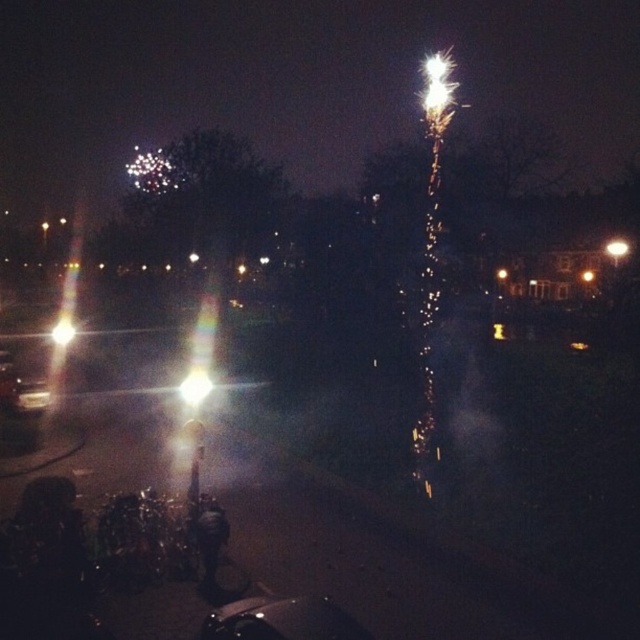
You are a photographer trying to capture the fireworks. You notice two light sources in your viewfinder, the bright white light at center and the bright metallic streetlight at left. Which one appears shorter in your photo?

The bright white light at center appears shorter because it is not as tall as the bright metallic streetlight at left.

You are a photographer trying to capture the fireworks display. You notice two light sources in your frame, the bright white light at center and the bright metallic streetlight at left. Which light source takes up more space in your photo?

The bright metallic streetlight at left takes up more space in the photo than the bright white light at center because the bright white light at center occupies less space than the bright metallic streetlight at left.

You are standing at point [20,387] and want to move towards the nearest streetlight. Is there a shiny silver car at left blocking your path?

The shiny silver car at left is located at point [20,387], so you are already at the location of the shiny silver car at left. Therefore, there is no obstruction in your path to the nearest streetlight.